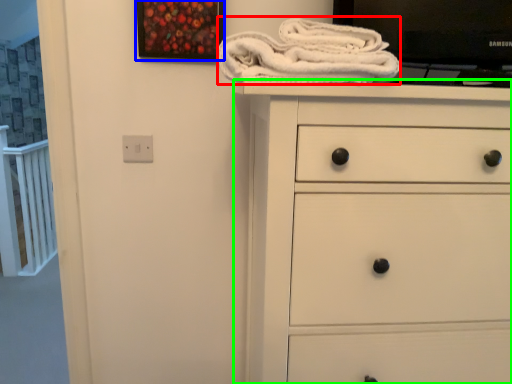
Question: Which object is positioned farthest from bath towel (highlighted by a red box)? Select from picture frame (highlighted by a blue box) and chest of drawers (highlighted by a green box).

Choices:
 (A) picture frame
 (B) chest of drawers

Answer: (A)